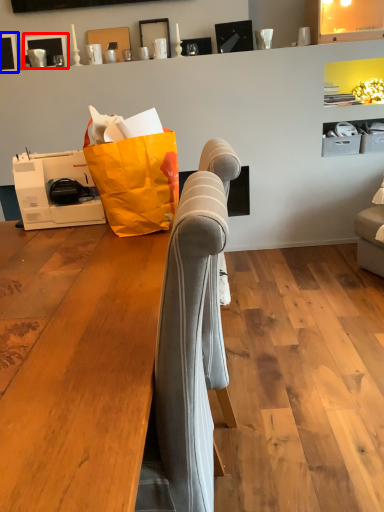
Question: Which point is further to the camera, picture frame (highlighted by a red box) or picture frame (highlighted by a blue box)?

Choices:
 (A) picture frame
 (B) picture frame

Answer: (A)